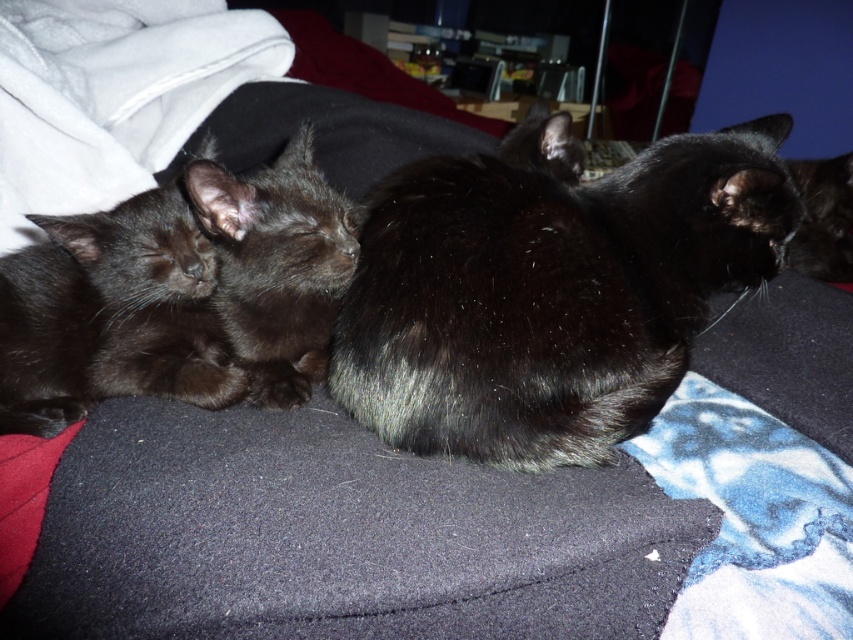
You are holding a small toy that is 2 inches in diameter. You want to place it on the bed where the cats are resting so that it is exactly halfway between the largest cat and the two smaller kittens. The point you calculated for placement is at coordinates point (372, 374). Is this point within the visible area of the bed in the image?

The point (372, 374) is 23.16 inches from the viewer. Since the toy is only 2 inches in diameter, placing it at this point would be feasible as the distance is sufficient to accommodate the toy within the visible area of the bed.